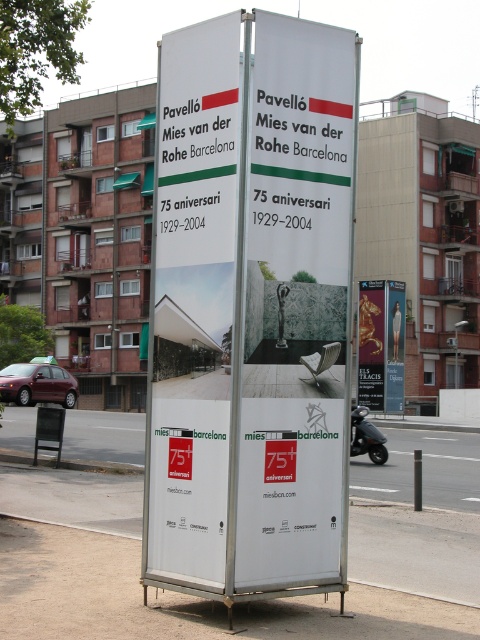
Question: Can you confirm if white paper billboard at center is positioned above metallic bus stop at lower left?

Choices:
 (A) no
 (B) yes

Answer: (B)

Question: Which is farther from the white paper billboard at center?

Choices:
 (A) gold metallic statue at center
 (B) metallic bus stop at lower left

Answer: (A)

Question: Which point appears closest to the camera in this image?

Choices:
 (A) (36, 460)
 (B) (259, 122)

Answer: (B)

Question: Is white paper billboard at center wider than gold metallic statue at center?

Choices:
 (A) yes
 (B) no

Answer: (B)

Question: Estimate the real-world distances between objects in this image. Which object is farther from the white paper billboard at center?

Choices:
 (A) gold metallic statue at center
 (B) metallic bus stop at lower left

Answer: (A)

Question: Can you confirm if white paper billboard at center is positioned above gold metallic statue at center?

Choices:
 (A) yes
 (B) no

Answer: (A)